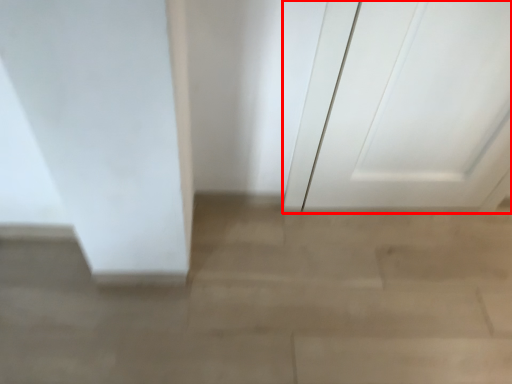
Question: From the image, what is the correct spatial relationship of door (annotated by the red box) in relation to concrete?

Choices:
 (A) left
 (B) right

Answer: (B)